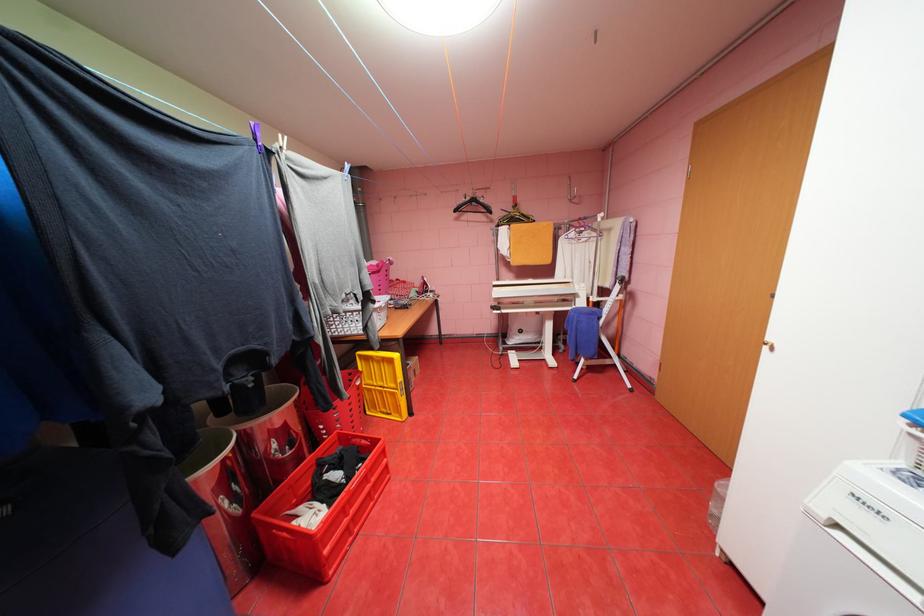
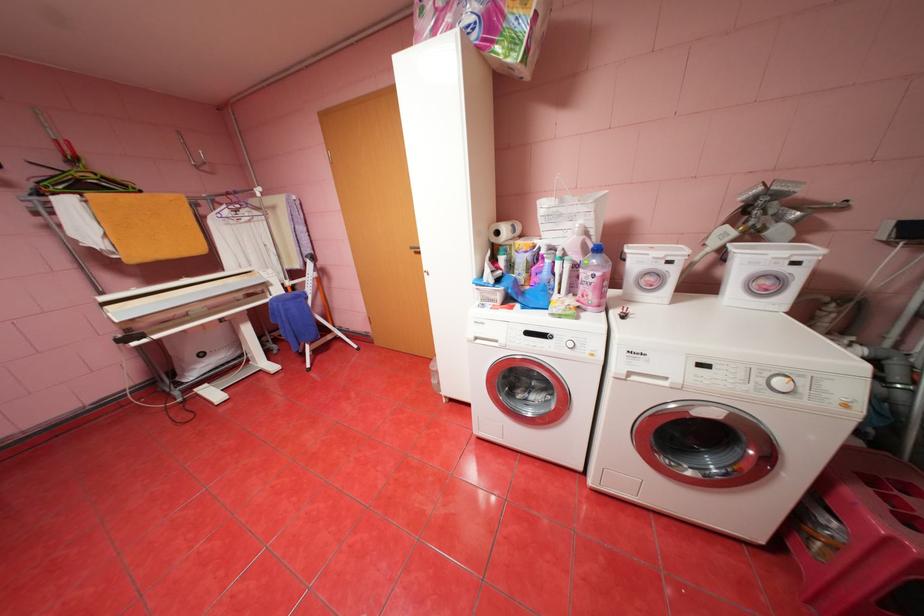
Question: How did the camera likely rotate?

Choices:
 (A) Left
 (B) Right
 (C) Up
 (D) Down

Answer: (B)